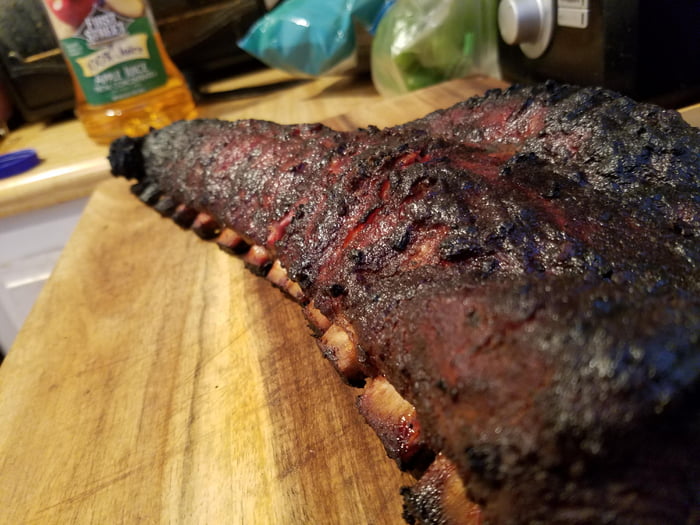
Locate an element on the screen. This screenshot has height=525, width=700. microwave control is located at coordinates (524, 13).